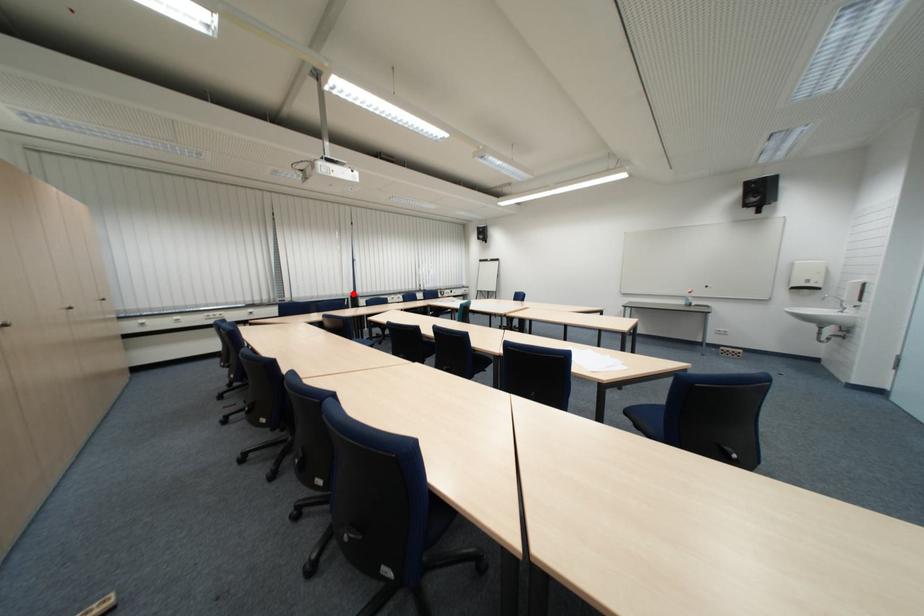
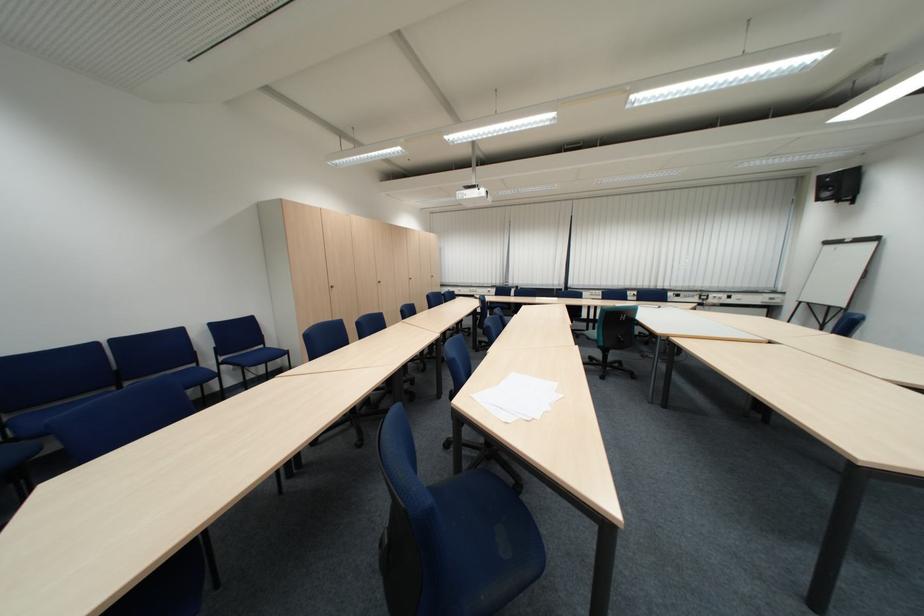
Locate, in the second image, the point that corresponds to the highlighted location in the first image.

(564, 284)